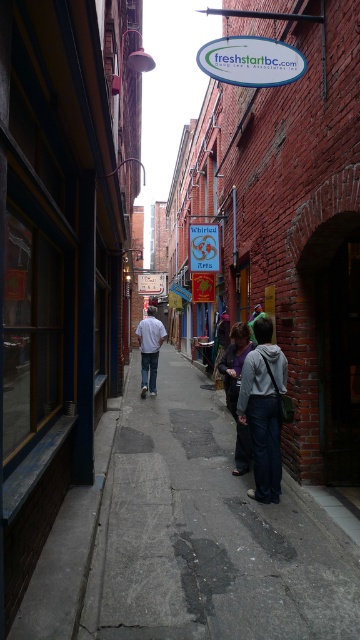
Is dark gray hoodie at center positioned before white cotton shirt at center?

Yes, dark gray hoodie at center is in front of white cotton shirt at center.

From the picture: Does dark gray hoodie at center have a lesser width compared to white cotton shirt at center?

Yes, dark gray hoodie at center is thinner than white cotton shirt at center.

Does point (248, 342) come in front of point (165, 333)?

Yes, point (248, 342) is in front of point (165, 333).

In order to click on dark gray hoodie at center in this screenshot , I will do `click(236, 390)`.

In the scene shown: Who is positioned more to the left, concrete sidewalk at center or white cotton shirt at center?

white cotton shirt at center is more to the left.

Does point (182, 480) lie behind point (142, 388)?

No, it is in front of (142, 388).

The height and width of the screenshot is (640, 360). Describe the element at coordinates (206, 534) in the screenshot. I see `concrete sidewalk at center` at that location.

Where is `concrete sidewalk at center`? concrete sidewalk at center is located at coordinates (206, 534).

Who is positioned more to the right, concrete sidewalk at center or dark gray hoodie at center?

dark gray hoodie at center is more to the right.

Does concrete sidewalk at center have a lesser height compared to dark gray hoodie at center?

Yes, concrete sidewalk at center is shorter than dark gray hoodie at center.

Image resolution: width=360 pixels, height=640 pixels. I want to click on concrete sidewalk at center, so click(206, 534).